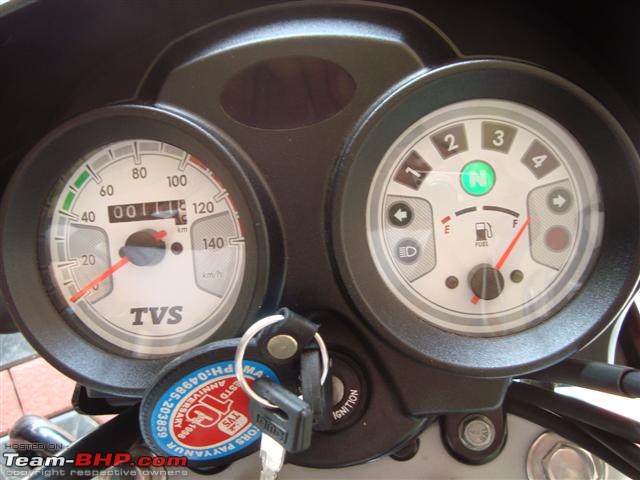
Identify the location of black console. Image resolution: width=640 pixels, height=480 pixels. (298, 160).